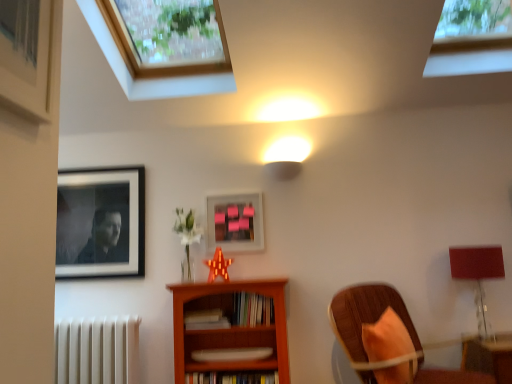
Question: From the image's perspective, relative to pink matte picture frame at center, which is counted as the 1th picture frame, starting from the right, is hardcover books at center, the first book viewed from the top, above or below?

Choices:
 (A) below
 (B) above

Answer: (A)

Question: From a real-world perspective, is hardcover books at center, the first book viewed from the top, above or below pink matte picture frame at center, placed as the second picture frame when sorted from left to right?

Choices:
 (A) above
 (B) below

Answer: (B)

Question: Considering the real-world distances, which object is farthest from the hardcover book at center, which is the first book from bottom to top?

Choices:
 (A) wooden chair with orange cushion at lower right
 (B) wooden bookcase at center
 (C) black matte portrait at upper left, placed as the 2th picture frame when sorted from right to left
 (D) white matte radiator at lower left
 (E) hardcover books at center, positioned as the third book in bottom-to-top order

Answer: (C)

Question: Which of these objects is positioned farthest from the hardcover books at center, the first book viewed from the top?

Choices:
 (A) wooden chair with orange cushion at lower right
 (B) white matte radiator at lower left
 (C) wooden frame window at upper left, the 2th window in the right-to-left sequence
 (D) wooden bookcase at center
 (E) black matte portrait at upper left, placed as the 2th picture frame when sorted from right to left

Answer: (C)